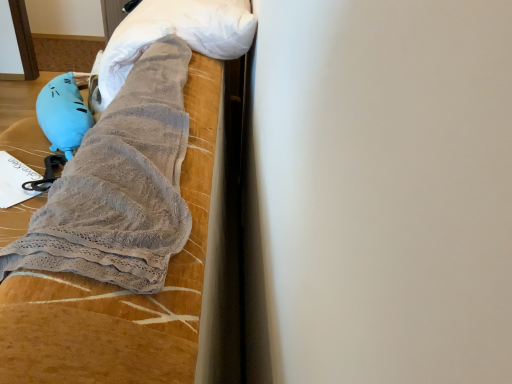
Question: From a real-world perspective, does velvet-like fabric bedspread at upper left sit lower than matte blue plush at left?

Choices:
 (A) yes
 (B) no

Answer: (A)

Question: Does velvet-like fabric bedspread at upper left have a lesser height compared to matte blue plush at left?

Choices:
 (A) yes
 (B) no

Answer: (B)

Question: Is velvet-like fabric bedspread at upper left closer to the viewer compared to matte blue plush at left?

Choices:
 (A) yes
 (B) no

Answer: (A)

Question: Does velvet-like fabric bedspread at upper left have a larger size compared to matte blue plush at left?

Choices:
 (A) yes
 (B) no

Answer: (A)

Question: Is velvet-like fabric bedspread at upper left positioned with its back to matte blue plush at left?

Choices:
 (A) yes
 (B) no

Answer: (B)

Question: Could you tell me if velvet-like fabric bedspread at upper left is facing matte blue plush at left?

Choices:
 (A) yes
 (B) no

Answer: (A)

Question: Is matte blue plush at left taller than gray fuzzy towel at upper center?

Choices:
 (A) yes
 (B) no

Answer: (B)

Question: From the image's perspective, is matte blue plush at left above gray fuzzy towel at upper center?

Choices:
 (A) yes
 (B) no

Answer: (B)

Question: Is matte blue plush at left far from gray fuzzy towel at upper center?

Choices:
 (A) no
 (B) yes

Answer: (A)

Question: Is matte blue plush at left looking in the opposite direction of gray fuzzy towel at upper center?

Choices:
 (A) no
 (B) yes

Answer: (A)

Question: Could you tell me if matte blue plush at left is facing gray fuzzy towel at upper center?

Choices:
 (A) yes
 (B) no

Answer: (B)

Question: Is matte blue plush at left positioned before gray fuzzy towel at upper center?

Choices:
 (A) yes
 (B) no

Answer: (B)

Question: Is matte blue plush at left turned away from velvet-like fabric bedspread at upper left?

Choices:
 (A) no
 (B) yes

Answer: (B)